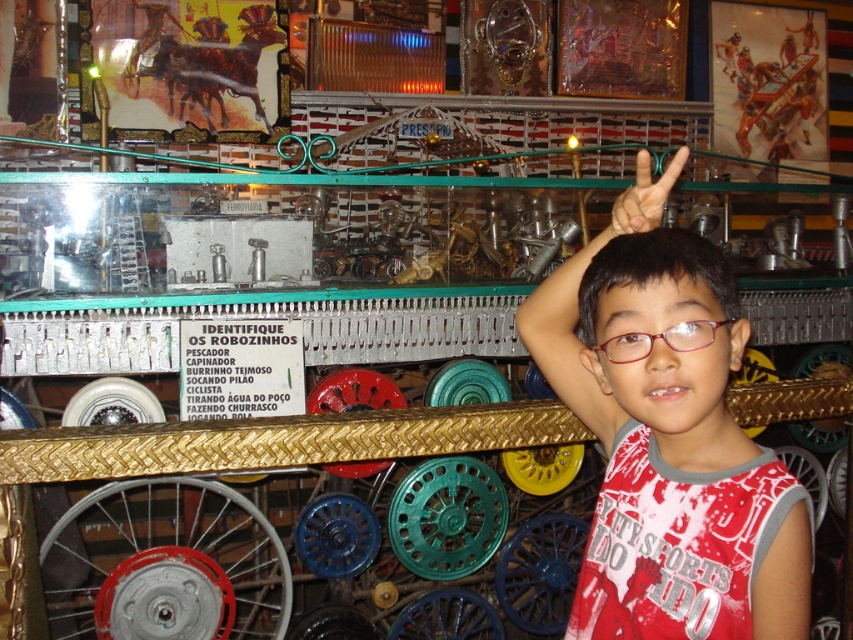
Consider the image. You are a customer in the store and want to grab a toy from the shelf behind the boy. The white cotton shirt at upper right and the white matte hand at upper right are in your way. Which object should you move first to get a clear path?

You should move the white cotton shirt at upper right first because it is closer to you than the white matte hand at upper right, so removing it would clear the path first.

You are the boy in the scene. You want to touch your clear plastic glasses at upper right with your white matte hand at upper right. Is your hand already positioned above the glasses?

Yes, the white matte hand at upper right is located above the clear plastic glasses at upper right, so the hand is already positioned above the glasses.